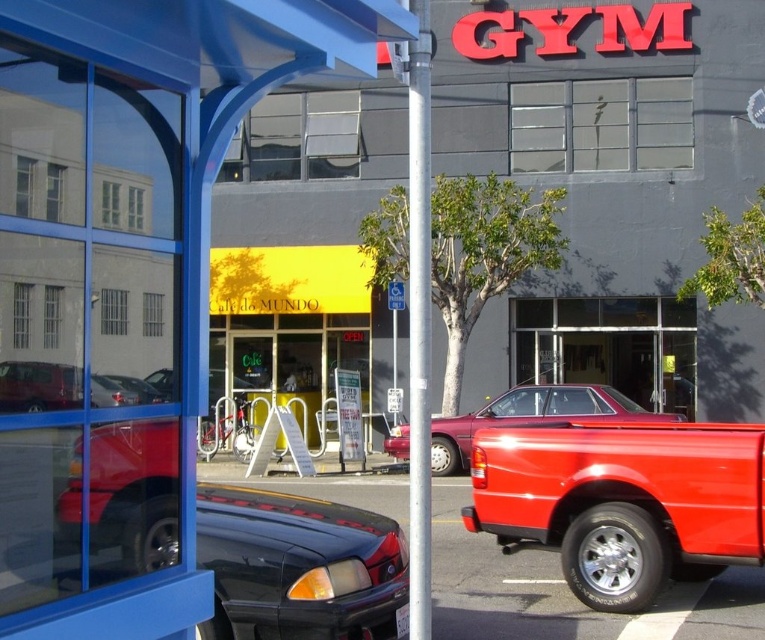
Does shiny red pickup truck at right appear on the left side of shiny red pickup truck at center?

Indeed, shiny red pickup truck at right is positioned on the left side of shiny red pickup truck at center.

Who is shorter, shiny red pickup truck at right or shiny red pickup truck at center?

Standing shorter between the two is shiny red pickup truck at right.

Is point (532, 433) less distant than point (454, 436)?

That is True.

Locate an element on the screen. shiny red pickup truck at right is located at coordinates (624, 500).

Does matte red truck at left come in front of shiny black sedan at center?

That is True.

Is matte red truck at left to the left of shiny black sedan at center from the viewer's perspective?

Indeed, matte red truck at left is positioned on the left side of shiny black sedan at center.

Where is `matte red truck at left`? This screenshot has height=640, width=765. matte red truck at left is located at coordinates (38, 387).

Locate an element on the screen. matte red truck at left is located at coordinates (38, 387).

Looking at this image, can you confirm if shiny red pickup truck at right is bigger than matte red truck at left?

Correct, shiny red pickup truck at right is larger in size than matte red truck at left.

Is shiny red pickup truck at right positioned before matte red truck at left?

No, shiny red pickup truck at right is further to the viewer.

Which is behind, point (757, 445) or point (47, 396)?

Positioned behind is point (757, 445).

The height and width of the screenshot is (640, 765). In order to click on shiny red pickup truck at right in this screenshot , I will do `click(624, 500)`.